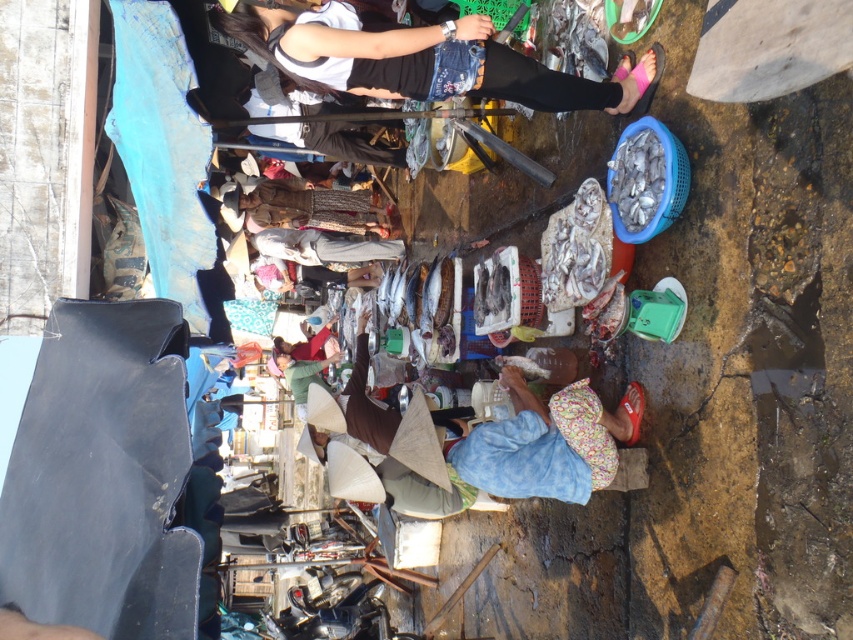
Question: Is light gray fabric pants at center below red fabric shirt at center?

Choices:
 (A) no
 (B) yes

Answer: (A)

Question: Which point appears closest to the camera in this image?

Choices:
 (A) (312, 349)
 (B) (273, 282)
 (C) (280, 40)

Answer: (C)

Question: Which of the following is the closest to the observer?

Choices:
 (A) denim pants at upper center
 (B) light gray fabric pants at center
 (C) red fabric shirt at center

Answer: (A)

Question: Is light gray fabric pants at center to the right of dark brown woven hat at center from the viewer's perspective?

Choices:
 (A) yes
 (B) no

Answer: (B)

Question: Does light gray fabric pants at center appear over dark brown woven hat at center?

Choices:
 (A) no
 (B) yes

Answer: (B)

Question: Which object is closer to the camera taking this photo?

Choices:
 (A) denim pants at upper center
 (B) dark brown woven hat at center
 (C) light gray fabric pants at center

Answer: (A)